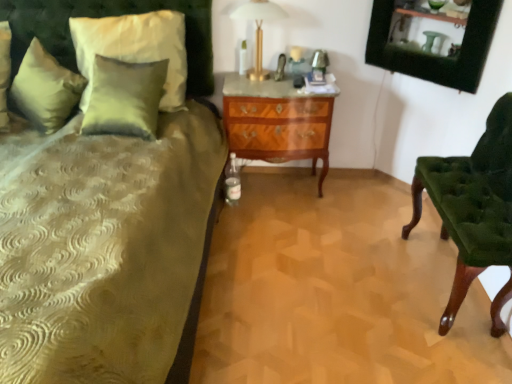
This screenshot has width=512, height=384. What are the coordinates of `space that is in front of mahogany wood drawer at center` in the screenshot? It's located at (280, 225).